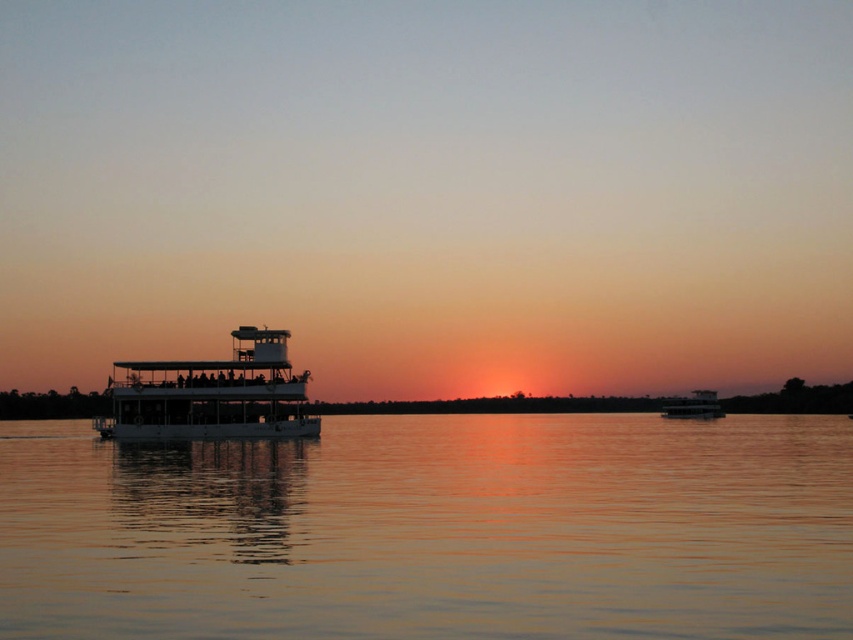
Based on the photo, you are an observer standing on the shore looking at the sunset scene. You notice the smooth water at center and the white matte boat at center. Which object appears taller in the image?

The smooth water at center appears taller than the white matte boat at center in the image.

You are standing at point 0.5,0.5 in the image coordinate system. You want to move to the white matte boat at center. Which direction should you move? North, South, East, or West?

The white matte boat at center is located at point (212, 394). Since you are at (426, 320), you need to move North and West to reach it.